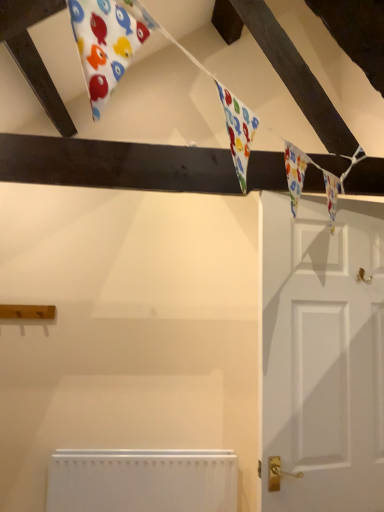
Question: Does white matte door at right turn towards white matte radiator at lower center?

Choices:
 (A) yes
 (B) no

Answer: (A)

Question: Is white matte door at right shorter than white matte radiator at lower center?

Choices:
 (A) yes
 (B) no

Answer: (B)

Question: Does white matte door at right have a lesser width compared to white matte radiator at lower center?

Choices:
 (A) yes
 (B) no

Answer: (A)

Question: From a real-world perspective, does white matte door at right sit lower than white matte radiator at lower center?

Choices:
 (A) no
 (B) yes

Answer: (A)

Question: Is white matte door at right at the right side of white matte radiator at lower center?

Choices:
 (A) no
 (B) yes

Answer: (B)

Question: Does white matte door at right lie behind white matte radiator at lower center?

Choices:
 (A) no
 (B) yes

Answer: (A)

Question: Is white matte radiator at lower center taller than white matte door at right?

Choices:
 (A) yes
 (B) no

Answer: (B)

Question: Is white matte radiator at lower center positioned in front of white matte door at right?

Choices:
 (A) no
 (B) yes

Answer: (A)

Question: Is white matte radiator at lower center thinner than white matte door at right?

Choices:
 (A) no
 (B) yes

Answer: (A)

Question: Is white matte radiator at lower center next to white matte door at right and touching it?

Choices:
 (A) yes
 (B) no

Answer: (B)

Question: Is white matte radiator at lower center facing away from white matte door at right?

Choices:
 (A) no
 (B) yes

Answer: (A)

Question: Is white matte radiator at lower center completely or partially outside of white matte door at right?

Choices:
 (A) no
 (B) yes

Answer: (B)

Question: Is white matte door at right inside the boundaries of white matte radiator at lower center, or outside?

Choices:
 (A) outside
 (B) inside

Answer: (A)